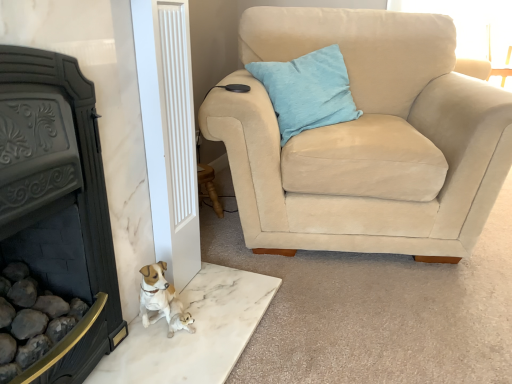
Question: Is beige suede armchair at upper right far away from light blue fabric pillow at upper right?

Choices:
 (A) yes
 (B) no

Answer: (B)

Question: Is light blue fabric pillow at upper right at the back of beige suede armchair at upper right?

Choices:
 (A) no
 (B) yes

Answer: (B)

Question: From a real-world perspective, does beige suede armchair at upper right sit lower than light blue fabric pillow at upper right?

Choices:
 (A) no
 (B) yes

Answer: (B)

Question: Does beige suede armchair at upper right turn towards light blue fabric pillow at upper right?

Choices:
 (A) yes
 (B) no

Answer: (A)

Question: From a real-world perspective, is beige suede armchair at upper right over light blue fabric pillow at upper right?

Choices:
 (A) yes
 (B) no

Answer: (B)

Question: From a real-world perspective, is light blue fabric pillow at upper right physically located above or below black cast iron fireplace at left?

Choices:
 (A) above
 (B) below

Answer: (A)

Question: From the image's perspective, is light blue fabric pillow at upper right located above or below black cast iron fireplace at left?

Choices:
 (A) above
 (B) below

Answer: (A)

Question: Is point click(x=327, y=99) positioned closer to the camera than point click(x=77, y=258)?

Choices:
 (A) farther
 (B) closer

Answer: (A)

Question: Is light blue fabric pillow at upper right in front of or behind black cast iron fireplace at left in the image?

Choices:
 (A) front
 (B) behind

Answer: (B)

Question: Considering the positions of light blue fabric pillow at upper right and beige suede armchair at upper right in the image, is light blue fabric pillow at upper right taller or shorter than beige suede armchair at upper right?

Choices:
 (A) short
 (B) tall

Answer: (A)

Question: Considering the positions of light blue fabric pillow at upper right and beige suede armchair at upper right in the image, is light blue fabric pillow at upper right bigger or smaller than beige suede armchair at upper right?

Choices:
 (A) small
 (B) big

Answer: (A)

Question: Relative to beige suede armchair at upper right, is light blue fabric pillow at upper right in front or behind?

Choices:
 (A) behind
 (B) front

Answer: (A)

Question: Is light blue fabric pillow at upper right to the left or to the right of beige suede armchair at upper right in the image?

Choices:
 (A) left
 (B) right

Answer: (A)

Question: Would you say beige suede armchair at upper right is to the left or to the right of light blue fabric pillow at upper right in the picture?

Choices:
 (A) right
 (B) left

Answer: (A)

Question: Looking at the image, does beige suede armchair at upper right seem bigger or smaller compared to light blue fabric pillow at upper right?

Choices:
 (A) big
 (B) small

Answer: (A)